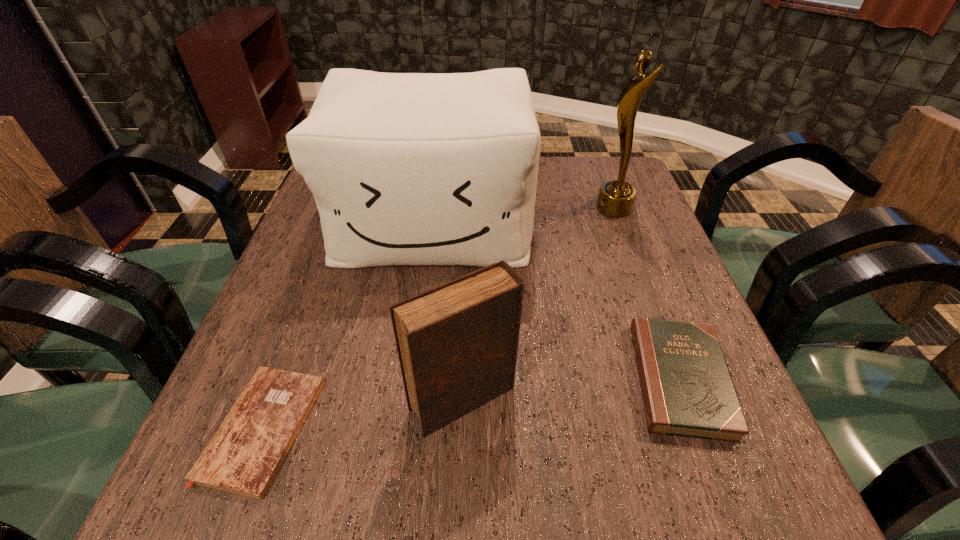
Find the location of a particular element. The width and height of the screenshot is (960, 540). award that is positioned at the right edge is located at coordinates (616, 198).

This screenshot has width=960, height=540. In order to click on Bible located in the right edge section of the desktop in this screenshot , I will do `click(687, 390)`.

Where is `object present at the far left corner`? The image size is (960, 540). object present at the far left corner is located at coordinates (406, 168).

The height and width of the screenshot is (540, 960). I want to click on object that is at the near left corner, so coord(244,455).

You are a GUI agent. You are given a task and a screenshot of the screen. Output one action in this format:
    pyautogui.click(x=<x>, y=<y>)
    Task: Click on the object located in the far right corner section of the desktop
    The height and width of the screenshot is (540, 960).
    Given the screenshot: What is the action you would take?
    coord(616,198)

Find the location of a particular element. Image resolution: width=960 pixels, height=540 pixels. blank space at the far edge of the desktop is located at coordinates (542, 170).

In the image, there is a desktop. Identify the location of vacant space at the near edge. The image size is (960, 540). (617, 465).

I want to click on free region at the left edge, so coord(290,265).

At what (x,y) coordinates should I click in order to perform the action: click on vacant space at the near left corner of the desktop. Please return your answer as a coordinate pair (x, y). This screenshot has width=960, height=540. Looking at the image, I should click on (211, 505).

This screenshot has width=960, height=540. In order to click on vacant point at the far right corner in this screenshot , I will do `click(598, 171)`.